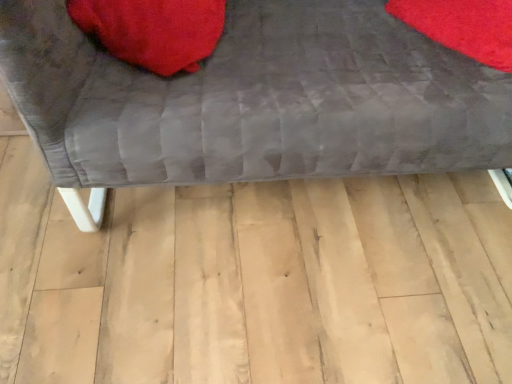
Question: Is velvet red bean bag at upper left taller or shorter than velvet gray couch at center?

Choices:
 (A) short
 (B) tall

Answer: (A)

Question: Which is correct: velvet red bean bag at upper left is inside velvet gray couch at center, or outside of it?

Choices:
 (A) outside
 (B) inside

Answer: (B)

Question: Is velvet red bean bag at upper left to the left or to the right of velvet gray couch at center in the image?

Choices:
 (A) left
 (B) right

Answer: (A)

Question: Would you say velvet gray couch at center is to the left or to the right of velvet red bean bag at upper left in the picture?

Choices:
 (A) left
 (B) right

Answer: (B)

Question: From a real-world perspective, is velvet gray couch at center physically located above or below velvet red bean bag at upper left?

Choices:
 (A) below
 (B) above

Answer: (A)

Question: Looking at their shapes, would you say velvet gray couch at center is wider or thinner than velvet red bean bag at upper left?

Choices:
 (A) wide
 (B) thin

Answer: (A)

Question: Is velvet gray couch at center in front of or behind velvet red bean bag at upper left in the image?

Choices:
 (A) front
 (B) behind

Answer: (A)